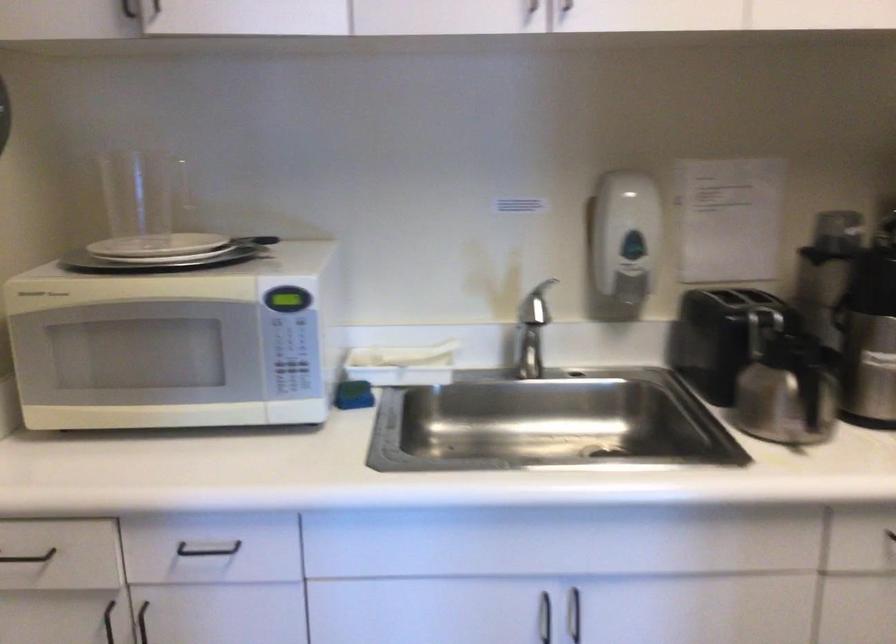
The height and width of the screenshot is (644, 896). What are the coordinates of `clear glass` in the screenshot? It's located at (144, 196).